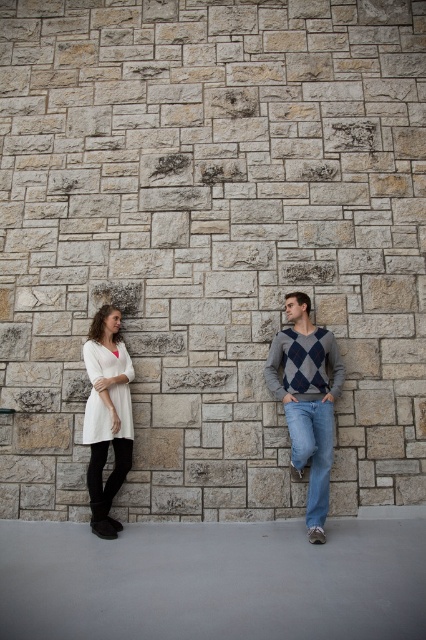
Question: Can you confirm if argyle sweater at center is positioned below denim jeans at lower right?

Choices:
 (A) yes
 (B) no

Answer: (B)

Question: Which of the following is the farthest from the observer?

Choices:
 (A) (322, 420)
 (B) (301, 442)
 (C) (111, 342)
 (D) (299, 413)

Answer: (C)

Question: Which is nearer to the argyle sweater at center?

Choices:
 (A) white cotton dress at left
 (B) denim jeans at lower right

Answer: (A)

Question: Which of the following is the farthest from the observer?

Choices:
 (A) white matte tunic at left
 (B) denim jeans at lower right

Answer: (A)

Question: Is white cotton dress at left thinner than argyle sweater at center?

Choices:
 (A) no
 (B) yes

Answer: (B)

Question: Where is argyle sweater at center located in relation to white matte tunic at left in the image?

Choices:
 (A) left
 (B) right

Answer: (B)